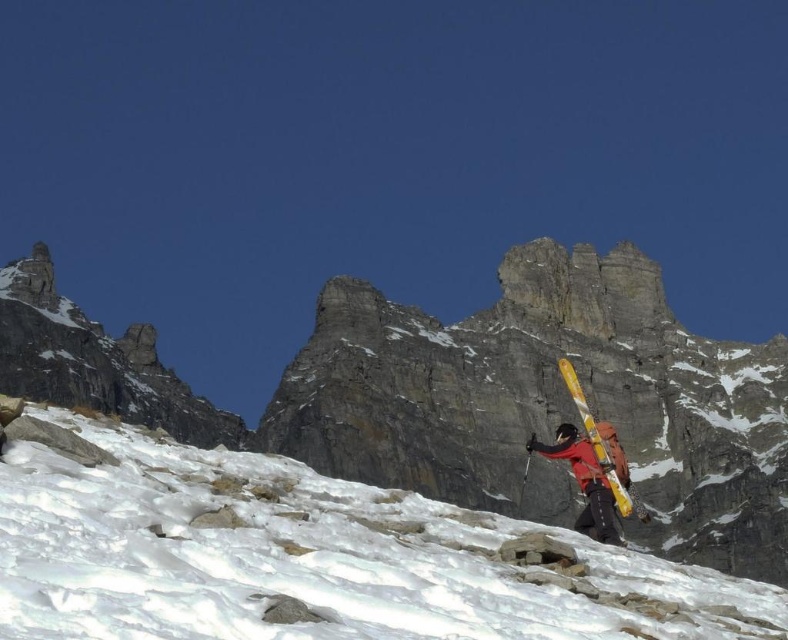
Is gray rocky mountain at center taller than yellow metallic skis at center?

Correct, gray rocky mountain at center is much taller as yellow metallic skis at center.

Describe the element at coordinates (470, 394) in the screenshot. I see `gray rocky mountain at center` at that location.

Which is behind, point (630, 380) or point (621, 477)?

Point (630, 380)

Where is `gray rocky mountain at center`? This screenshot has width=788, height=640. gray rocky mountain at center is located at coordinates (470, 394).

Can you confirm if white powdery snow at lower right is thinner than yellow metallic skis at center?

No, white powdery snow at lower right is not thinner than yellow metallic skis at center.

Is white powdery snow at lower right below yellow metallic skis at center?

No.

Which is behind, point (653, 564) or point (559, 452)?

Point (559, 452)

Identify the location of white powdery snow at lower right. The width and height of the screenshot is (788, 640). (310, 557).

Does gray rocky mountain at center have a larger size compared to white powdery snow at lower right?

Correct, gray rocky mountain at center is larger in size than white powdery snow at lower right.

Which is more to the right, gray rocky mountain at center or white powdery snow at lower right?

From the viewer's perspective, white powdery snow at lower right appears more on the right side.

What do you see at coordinates (470, 394) in the screenshot? I see `gray rocky mountain at center` at bounding box center [470, 394].

Where is `gray rocky mountain at center`? gray rocky mountain at center is located at coordinates (470, 394).